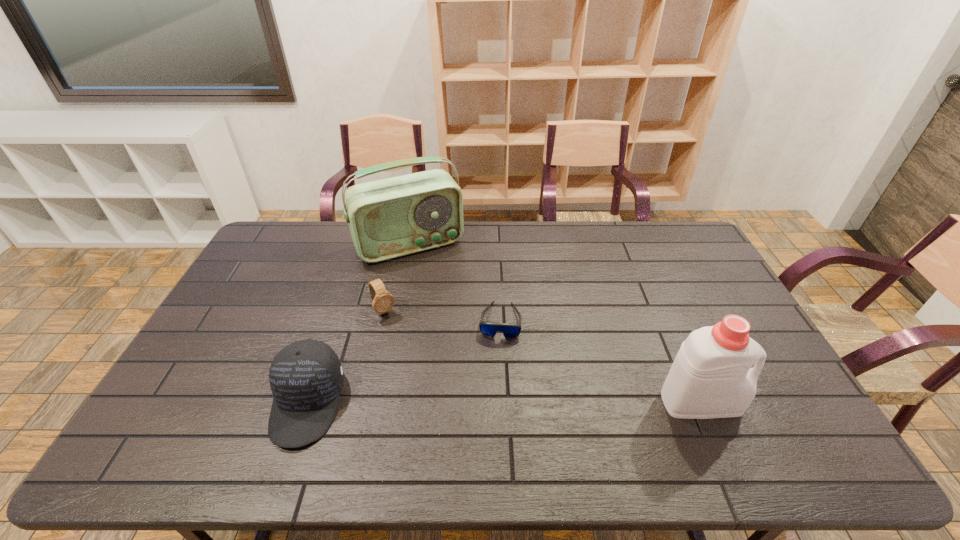
The height and width of the screenshot is (540, 960). Identify the location of vacant area located on the front panel of the radio receiver. (454, 316).

Find the location of a particular element. The width and height of the screenshot is (960, 540). vacant space located 0.290m on the front panel of the radio receiver is located at coordinates (457, 321).

The height and width of the screenshot is (540, 960). In order to click on vacant space located 0.310m on the front panel of the radio receiver in this screenshot , I will do `click(459, 325)`.

The height and width of the screenshot is (540, 960). I want to click on vacant area situated 0.310m on the face of the watch, so click(439, 390).

Locate an element on the screen. This screenshot has height=540, width=960. free location located 0.200m on the face of the watch is located at coordinates (420, 363).

Find the location of a particular element. Image resolution: width=960 pixels, height=540 pixels. vacant region located 0.340m on the face of the watch is located at coordinates (444, 399).

The image size is (960, 540). What are the coordinates of `object that is at the far edge` in the screenshot? It's located at (388, 218).

In order to click on baseball cap present at the near edge in this screenshot , I will do `click(306, 377)`.

You are a GUI agent. You are given a task and a screenshot of the screen. Output one action in this format:
    pyautogui.click(x=<x>, y=<y>)
    Task: Click on the detergent located at the near edge
    Image resolution: width=960 pixels, height=540 pixels.
    Given the screenshot: What is the action you would take?
    pyautogui.click(x=711, y=377)

Find the location of `object at the right edge`. object at the right edge is located at coordinates (711, 377).